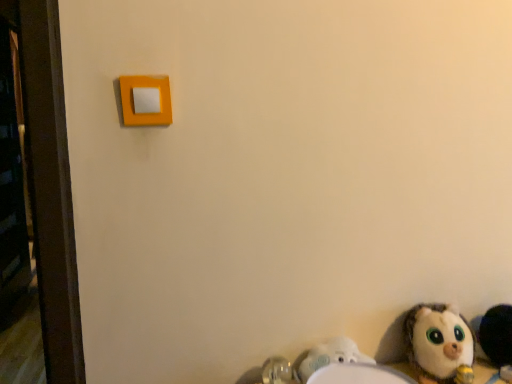
Question: Is white plush toy at lower right, which is counted as the 1th toy, starting from the left, to the left or to the right of matte orange light switch at upper left in the image?

Choices:
 (A) right
 (B) left

Answer: (A)

Question: Is white plush toy at lower right, arranged as the second toy when viewed from the right, wider or thinner than matte orange light switch at upper left?

Choices:
 (A) thin
 (B) wide

Answer: (B)

Question: Estimate the real-world distances between objects in this image. Which object is closer to the white plush toy at lower right, arranged as the second toy when viewed from the right?

Choices:
 (A) matte orange light switch at upper left
 (B) fluffy white stuffed animal at lower right, the 1th toy viewed from the right
 (C) white plastic sink at lower right

Answer: (B)

Question: Which object is the closest to the matte orange light switch at upper left?

Choices:
 (A) white plush toy at lower right, arranged as the second toy when viewed from the right
 (B) white plastic sink at lower right
 (C) fluffy white stuffed animal at lower right, the 1th toy viewed from the right

Answer: (B)